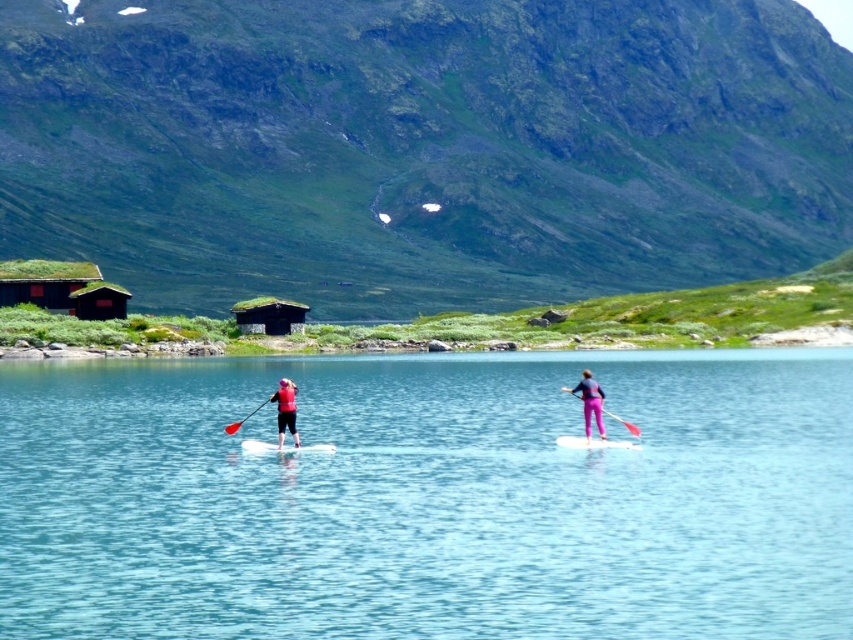
Which is behind, point (596, 417) or point (635, 433)?

The point (596, 417) is behind.

Can you confirm if pink fabric paddleboarder at center is positioned above pink fabric paddle at center?

Correct, pink fabric paddleboarder at center is located above pink fabric paddle at center.

Between point (602, 429) and point (606, 412), which one is positioned behind?

Positioned behind is point (606, 412).

This screenshot has width=853, height=640. What are the coordinates of `pink fabric paddleboarder at center` in the screenshot? It's located at (589, 403).

Is green mossy rock at upper center to the right of pink fabric paddleboarder at center from the viewer's perspective?

Indeed, green mossy rock at upper center is positioned on the right side of pink fabric paddleboarder at center.

Can you confirm if green mossy rock at upper center is wider than pink fabric paddleboarder at center?

Correct, the width of green mossy rock at upper center exceeds that of pink fabric paddleboarder at center.

Between point (3, 168) and point (599, 400), which one is positioned behind?

The point (3, 168) is more distant.

Image resolution: width=853 pixels, height=640 pixels. Find the location of `green mossy rock at upper center`. green mossy rock at upper center is located at coordinates (421, 147).

Is green mossy roof hut at center thinner than white foam kayak at center?

No.

Does point (242, 317) come closer to viewer compared to point (289, 449)?

No, (242, 317) is further to viewer.

The width and height of the screenshot is (853, 640). Find the location of `green mossy roof hut at center`. green mossy roof hut at center is located at coordinates (270, 316).

Where is `green mossy roof hut at center`? This screenshot has height=640, width=853. green mossy roof hut at center is located at coordinates (270, 316).